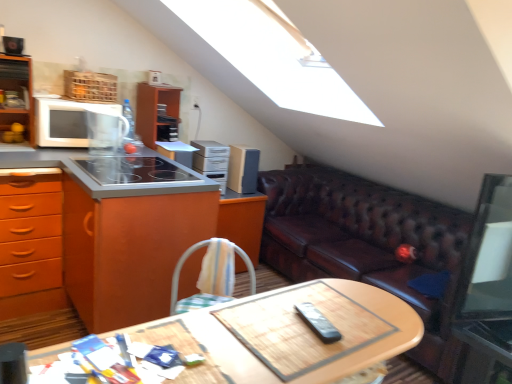
Question: Considering the relative sizes of metallic silver side table at lower right and wooden at center in the image provided, is metallic silver side table at lower right bigger than wooden at center?

Choices:
 (A) yes
 (B) no

Answer: (B)

Question: Considering the relative sizes of metallic silver side table at lower right and wooden at center in the image provided, is metallic silver side table at lower right smaller than wooden at center?

Choices:
 (A) yes
 (B) no

Answer: (A)

Question: Is metallic silver side table at lower right not near wooden at center?

Choices:
 (A) no
 (B) yes

Answer: (B)

Question: Is wooden at center located within metallic silver side table at lower right?

Choices:
 (A) no
 (B) yes

Answer: (A)

Question: From the image's perspective, is metallic silver side table at lower right on wooden at center?

Choices:
 (A) no
 (B) yes

Answer: (A)

Question: In the image, is smooth glass cooktop at center left positioned in front of or behind metallic silver side table at lower right?

Choices:
 (A) front
 (B) behind

Answer: (B)

Question: From their relative heights in the image, would you say smooth glass cooktop at center left is taller or shorter than metallic silver side table at lower right?

Choices:
 (A) tall
 (B) short

Answer: (B)

Question: Is smooth glass cooktop at center left wider or thinner than metallic silver side table at lower right?

Choices:
 (A) thin
 (B) wide

Answer: (B)

Question: From the image's perspective, is smooth glass cooktop at center left located above or below metallic silver side table at lower right?

Choices:
 (A) below
 (B) above

Answer: (B)

Question: From a real-world perspective, is smooth glass cooktop at center left positioned above or below wooden at center?

Choices:
 (A) above
 (B) below

Answer: (A)

Question: Considering the positions of smooth glass cooktop at center left and wooden at center in the image, is smooth glass cooktop at center left wider or thinner than wooden at center?

Choices:
 (A) wide
 (B) thin

Answer: (A)

Question: Considering the positions of point (178, 170) and point (297, 377), is point (178, 170) closer or farther from the camera than point (297, 377)?

Choices:
 (A) closer
 (B) farther

Answer: (B)

Question: Based on their positions, is smooth glass cooktop at center left located to the left or right of wooden at center?

Choices:
 (A) left
 (B) right

Answer: (A)

Question: From the image's perspective, is black plastic remote at center, which appears as the 1th appliance when viewed from the front, positioned above or below brown leather couch at right?

Choices:
 (A) below
 (B) above

Answer: (B)

Question: In terms of size, does black plastic remote at center, which appears as the 1th appliance when viewed from the front, appear bigger or smaller than brown leather couch at right?

Choices:
 (A) small
 (B) big

Answer: (A)